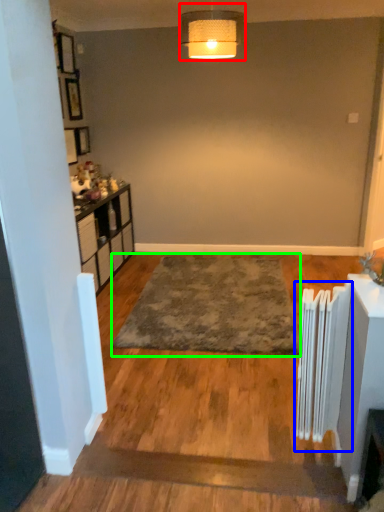
Question: Which object is the closest to the lamp (highlighted by a red box)? Choose among these: radiator (highlighted by a blue box) or mat (highlighted by a green box).

Choices:
 (A) radiator
 (B) mat

Answer: (B)